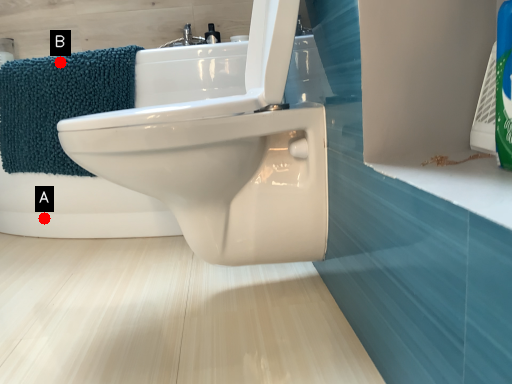
Question: Two points are circled on the image, labeled by A and B beside each circle. Which point appears farthest from the camera in this image?

Choices:
 (A) A is further
 (B) B is further

Answer: (A)